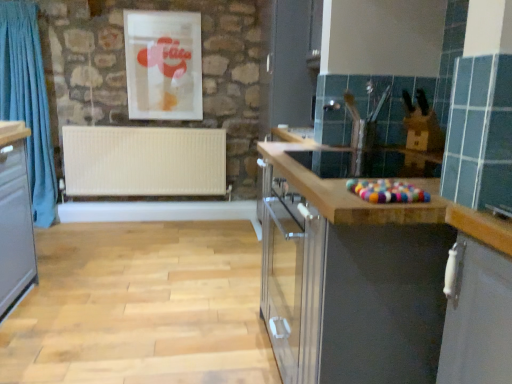
Question: Is blue fabric curtain at left smaller than matte plastic picture frame at upper center?

Choices:
 (A) yes
 (B) no

Answer: (B)

Question: From the image's perspective, does blue fabric curtain at left appear lower than matte plastic picture frame at upper center?

Choices:
 (A) yes
 (B) no

Answer: (A)

Question: Is blue fabric curtain at left not close to matte plastic picture frame at upper center?

Choices:
 (A) no
 (B) yes

Answer: (A)

Question: Is the depth of blue fabric curtain at left greater than that of matte plastic picture frame at upper center?

Choices:
 (A) yes
 (B) no

Answer: (B)

Question: Is matte plastic picture frame at upper center a part of blue fabric curtain at left?

Choices:
 (A) yes
 (B) no

Answer: (B)

Question: From the image's perspective, is blue fabric curtain at left on matte plastic picture frame at upper center?

Choices:
 (A) no
 (B) yes

Answer: (A)

Question: Is the depth of white matte radiator at center less than that of blue fabric curtain at left?

Choices:
 (A) no
 (B) yes

Answer: (A)

Question: Considering the relative sizes of white matte radiator at center and blue fabric curtain at left in the image provided, is white matte radiator at center bigger than blue fabric curtain at left?

Choices:
 (A) no
 (B) yes

Answer: (A)

Question: Is white matte radiator at center turned away from blue fabric curtain at left?

Choices:
 (A) yes
 (B) no

Answer: (B)

Question: Could you tell me if white matte radiator at center is facing blue fabric curtain at left?

Choices:
 (A) yes
 (B) no

Answer: (B)

Question: From the image's perspective, would you say white matte radiator at center is positioned over blue fabric curtain at left?

Choices:
 (A) yes
 (B) no

Answer: (B)

Question: Is white matte radiator at center outside blue fabric curtain at left?

Choices:
 (A) no
 (B) yes

Answer: (B)

Question: Can you see matte plastic picture frame at upper center touching white matte radiator at center?

Choices:
 (A) yes
 (B) no

Answer: (B)